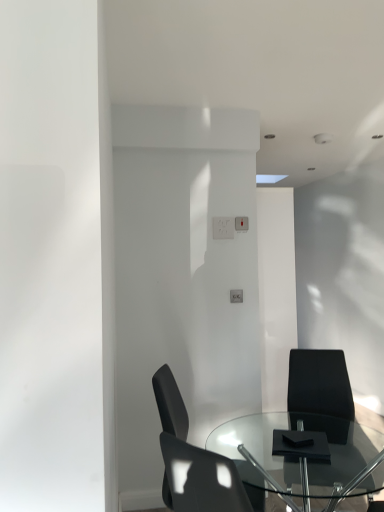
Question: Is black matte chair at lower right, acting as the first chair starting from the right, located outside matte black chair at lower center, which is the 2th chair in right-to-left order?

Choices:
 (A) yes
 (B) no

Answer: (A)

Question: Does black matte chair at lower right, placed as the 2th chair when sorted from left to right, have a greater width compared to matte black chair at lower center, which is the 2th chair in right-to-left order?

Choices:
 (A) yes
 (B) no

Answer: (A)

Question: From the image's perspective, is black matte chair at lower right, placed as the 2th chair when sorted from left to right, located above matte black chair at lower center, arranged as the 1th chair when viewed from the left?

Choices:
 (A) yes
 (B) no

Answer: (B)

Question: Could you tell me if black matte chair at lower right, acting as the first chair starting from the right, is facing matte black chair at lower center, which is the 2th chair in right-to-left order?

Choices:
 (A) yes
 (B) no

Answer: (B)

Question: Is matte black chair at lower center, arranged as the 1th chair when viewed from the left, at the back of black matte chair at lower right, placed as the 2th chair when sorted from left to right?

Choices:
 (A) yes
 (B) no

Answer: (B)

Question: In terms of width, does transparent glass table at center look wider or thinner when compared to black matte chair at lower right, placed as the 2th chair when sorted from left to right?

Choices:
 (A) wide
 (B) thin

Answer: (A)

Question: Visually, is transparent glass table at center positioned to the left or to the right of black matte chair at lower right, acting as the first chair starting from the right?

Choices:
 (A) left
 (B) right

Answer: (A)

Question: Which is correct: transparent glass table at center is inside black matte chair at lower right, acting as the first chair starting from the right, or outside of it?

Choices:
 (A) outside
 (B) inside

Answer: (A)

Question: From their relative heights in the image, would you say transparent glass table at center is taller or shorter than black matte chair at lower right, placed as the 2th chair when sorted from left to right?

Choices:
 (A) short
 (B) tall

Answer: (A)

Question: Is black matte chair at lower right, acting as the first chair starting from the right, wider or thinner than matte black chair at lower center, arranged as the 1th chair when viewed from the left?

Choices:
 (A) thin
 (B) wide

Answer: (B)

Question: From their relative heights in the image, would you say black matte chair at lower right, acting as the first chair starting from the right, is taller or shorter than matte black chair at lower center, which is the 2th chair in right-to-left order?

Choices:
 (A) short
 (B) tall

Answer: (B)

Question: Considering the positions of point (337, 409) and point (173, 454), is point (337, 409) closer or farther from the camera than point (173, 454)?

Choices:
 (A) closer
 (B) farther

Answer: (B)

Question: From a real-world perspective, is black matte chair at lower right, placed as the 2th chair when sorted from left to right, above or below matte black chair at lower center, arranged as the 1th chair when viewed from the left?

Choices:
 (A) below
 (B) above

Answer: (A)

Question: Relative to transparent glass table at center, is matte black chair at lower center, which is the 2th chair in right-to-left order, in front or behind?

Choices:
 (A) behind
 (B) front

Answer: (A)

Question: Do you think matte black chair at lower center, which is the 2th chair in right-to-left order, is within transparent glass table at center, or outside of it?

Choices:
 (A) outside
 (B) inside

Answer: (B)